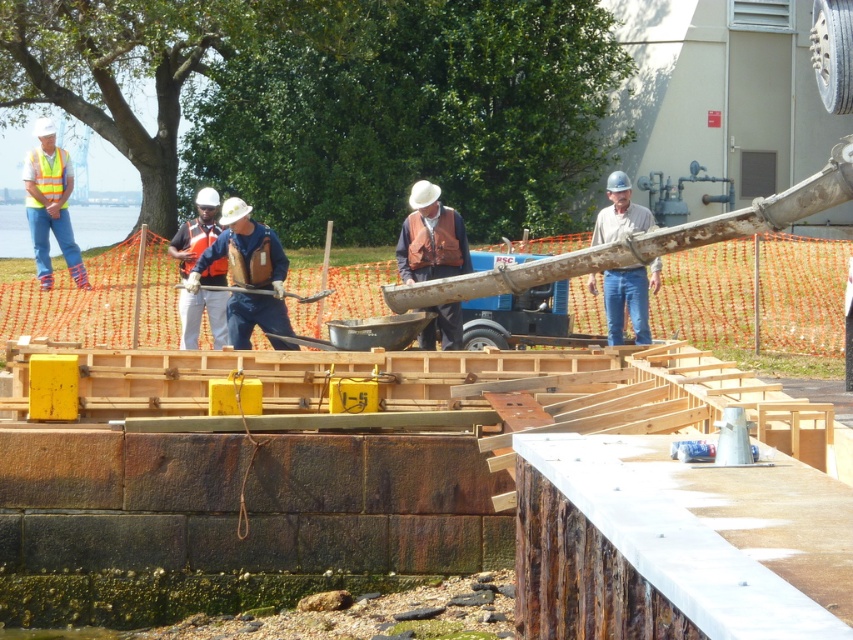
Based on the photo, you are a safety inspector standing at the camera position. You need to check the safety of the worker wearing the matte brown vest at center. Can you reach them within 10 meters without moving?

The matte brown vest at center is 15.93 meters away from the camera, so you cannot reach them within 10 meters without moving.